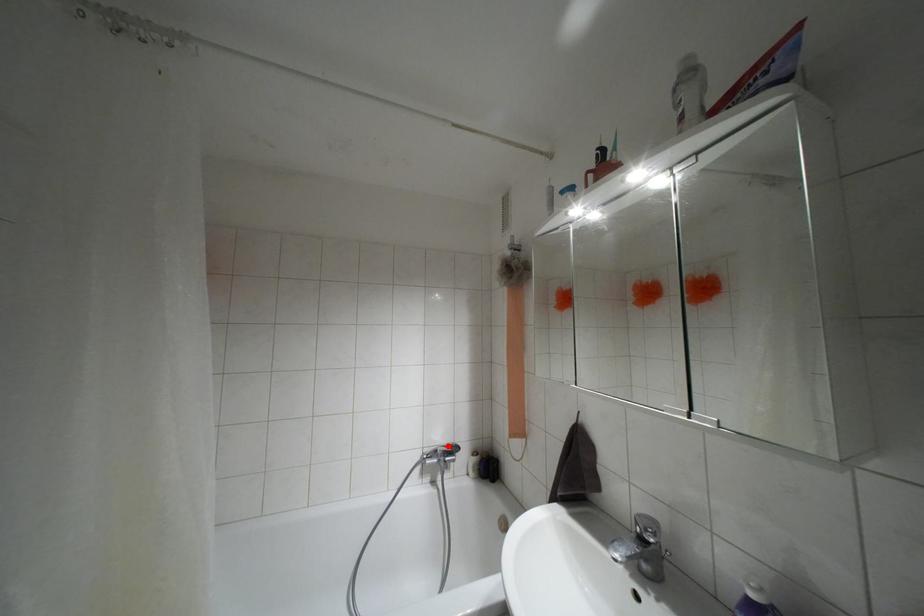
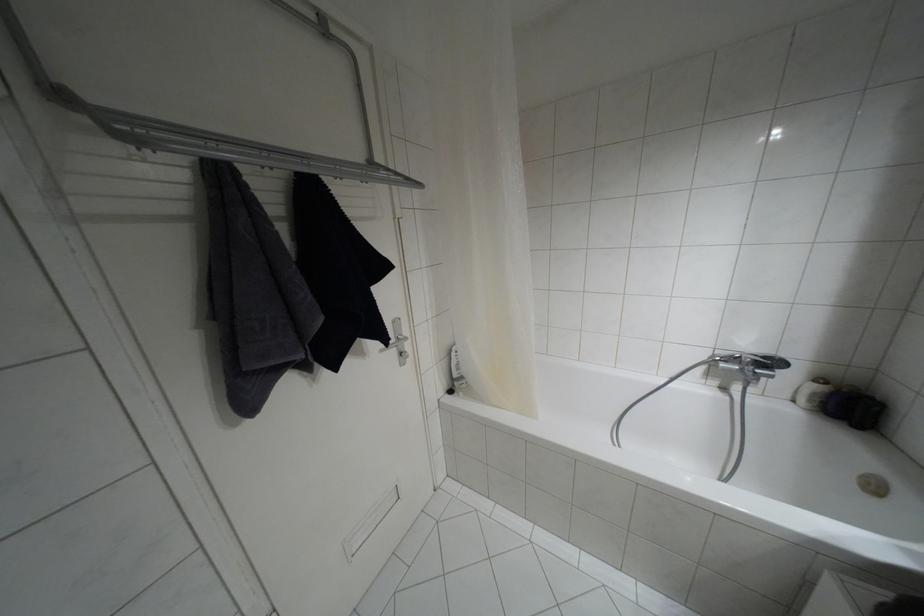
The point at the highlighted location is marked in the first image. Where is the corresponding point in the second image?

(763, 357)